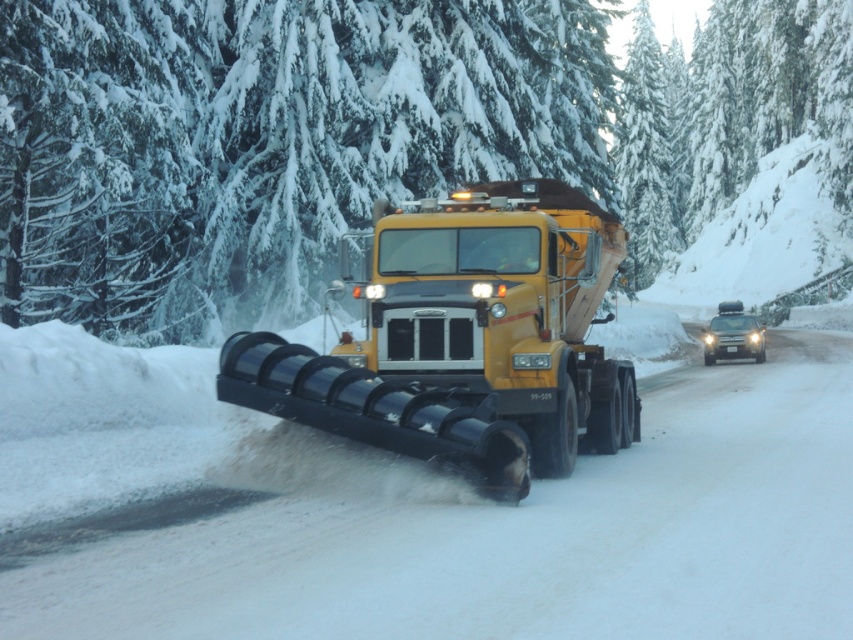
Question: Can you confirm if green snow-covered trees at upper center is wider than matte silver suv at right?

Choices:
 (A) yes
 (B) no

Answer: (A)

Question: From the image, what is the correct spatial relationship of yellow matte/solid truck at center in relation to matte silver suv at right?

Choices:
 (A) left
 (B) right

Answer: (A)

Question: Estimate the real-world distances between objects in this image. Which object is farther from the matte silver suv at right?

Choices:
 (A) yellow matte/solid truck at center
 (B) green snow-covered trees at upper center

Answer: (B)

Question: Is green snow-covered trees at upper center further to camera compared to yellow matte/solid truck at center?

Choices:
 (A) yes
 (B) no

Answer: (A)

Question: Estimate the real-world distances between objects in this image. Which object is closer to the green snow-covered trees at upper center?

Choices:
 (A) matte silver suv at right
 (B) yellow matte/solid truck at center

Answer: (A)

Question: Which of the following is the farthest from the observer?

Choices:
 (A) (451, 316)
 (B) (0, 52)

Answer: (B)